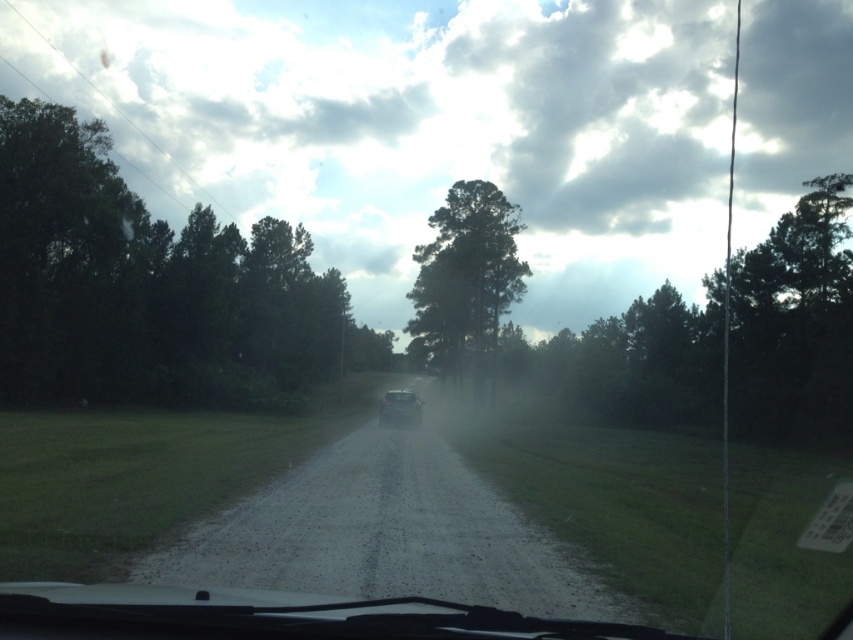
You are a GUI agent. You are given a task and a screenshot of the screen. Output one action in this format:
    pyautogui.click(x=<x>, y=<y>)
    Task: Click on the dark green foliage at left
    
    Given the screenshot: What is the action you would take?
    pyautogui.click(x=151, y=288)

Measure the distance between point (x=230, y=336) and camera.

Point (x=230, y=336) is 61.51 meters from camera.

Is point (128, 378) closer to viewer compared to point (486, 337)?

Yes, it is.

Image resolution: width=853 pixels, height=640 pixels. Find the location of `dark green foliage at left`. dark green foliage at left is located at coordinates (151, 288).

Does dark green foliage at left have a lesser height compared to shiny silver car at center?

No, dark green foliage at left is not shorter than shiny silver car at center.

Is dark green foliage at left smaller than shiny silver car at center?

No, dark green foliage at left is not smaller than shiny silver car at center.

Between point (260, 268) and point (398, 422), which one is positioned in front?

Point (398, 422) is more forward.

This screenshot has width=853, height=640. I want to click on dark green foliage at left, so click(x=151, y=288).

Measure the distance from green matte tree at center to shiny silver car at center.

green matte tree at center is 28.38 meters from shiny silver car at center.

Is point (492, 291) positioned before point (410, 392)?

No, (492, 291) is further to viewer.

The image size is (853, 640). Identify the location of green matte tree at center. (466, 280).